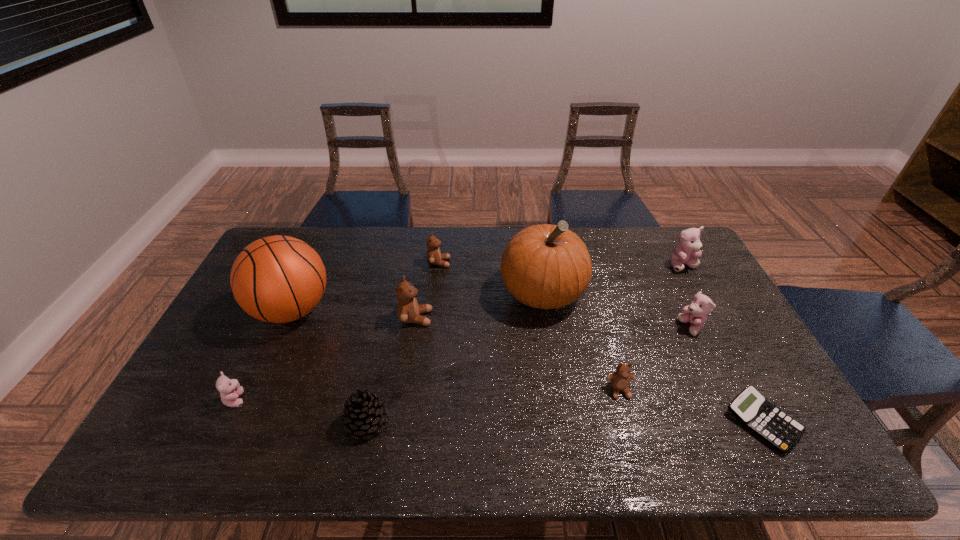
Find the location of a particular element. free spot between the farthest pink teddy bear and the pinecone is located at coordinates (525, 344).

The image size is (960, 540). What are the coordinates of `free spot between the second nearest pink teddy bear and the pinecone` in the screenshot? It's located at (529, 375).

Identify the location of vacant region between the pumpkin and the shortest object. (653, 357).

Locate an element on the screen. Image resolution: width=960 pixels, height=540 pixels. empty space that is in between the second farthest pink teddy bear and the basketball is located at coordinates (492, 319).

Where is `the seventh closest object to the nearest brown teddy bear`? The image size is (960, 540). the seventh closest object to the nearest brown teddy bear is located at coordinates (434, 257).

Where is `object that stands as the closest to the nearest pink teddy bear`? This screenshot has height=540, width=960. object that stands as the closest to the nearest pink teddy bear is located at coordinates (277, 279).

Identify which teddy bear is the fifth closest to the basketball. Please provide its 2D coordinates. Your answer should be formatted as a tuple, i.e. [(x, y)], where the tuple contains the x and y coordinates of a point satisfying the conditions above.

[(696, 313)]

Identify the location of the third closest teddy bear to the second biggest brown teddy bear. Image resolution: width=960 pixels, height=540 pixels. (230, 389).

Point out which pink teddy bear is positioned as the second nearest to the fourth teddy bear from left to right. Please provide its 2D coordinates. Your answer should be formatted as a tuple, i.e. [(x, y)], where the tuple contains the x and y coordinates of a point satisfying the conditions above.

[(689, 246)]

Identify the location of the second closest pink teddy bear to the pinecone. The height and width of the screenshot is (540, 960). (696, 313).